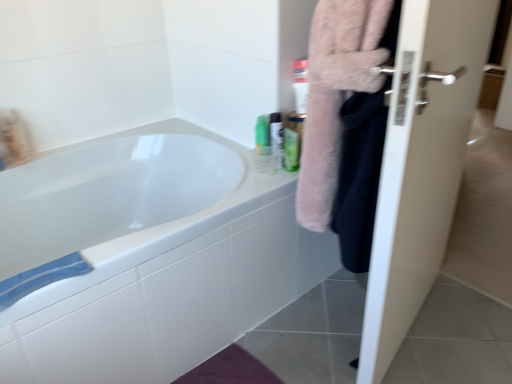
Find the location of a particular element. This screenshot has width=512, height=384. free space to the back side of translucent plastic mouthwash at upper left, arranged as the first mouthwash when viewed from the left is located at coordinates (51, 147).